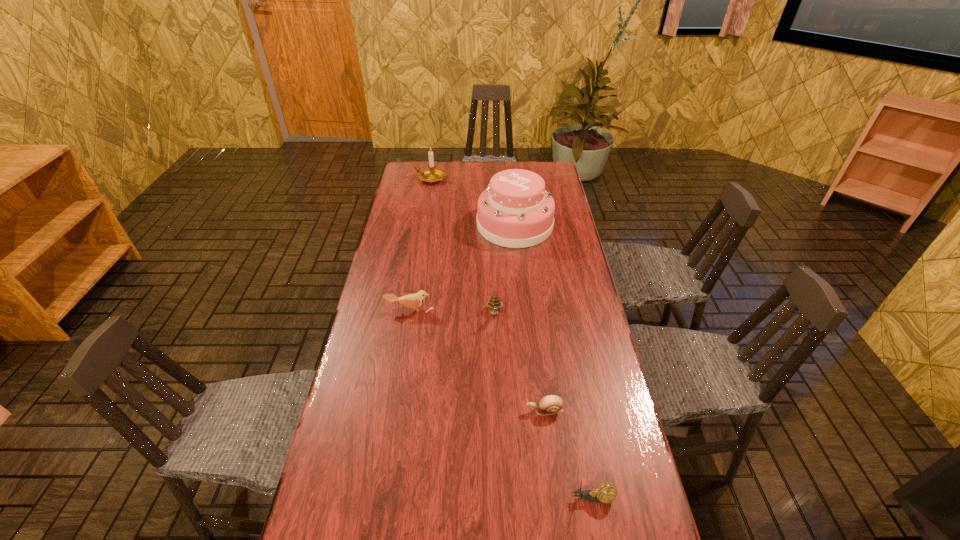
Locate an element on the screen. cake is located at coordinates (515, 211).

This screenshot has height=540, width=960. Find the location of `the fifth nearest object`. the fifth nearest object is located at coordinates (515, 211).

The width and height of the screenshot is (960, 540). Find the location of `the farthest object`. the farthest object is located at coordinates (431, 175).

You are a GUI agent. You are given a task and a screenshot of the screen. Output one action in this format:
    pyautogui.click(x=<x>, y=<y>)
    Task: Click on the candle holder
    Image resolution: width=960 pixels, height=540 pixels.
    Given the screenshot: What is the action you would take?
    pyautogui.click(x=431, y=175)

You are a GUI agent. You are given a task and a screenshot of the screen. Output one action in this format:
    pyautogui.click(x=<x>, y=<y>)
    Task: Click on the farthest escargot
    The image size is (960, 540).
    Given the screenshot: What is the action you would take?
    pyautogui.click(x=494, y=304)

The image size is (960, 540). In order to click on the tallest escargot in this screenshot , I will do `click(494, 304)`.

You are a GUI agent. You are given a task and a screenshot of the screen. Output one action in this format:
    pyautogui.click(x=<x>, y=<y>)
    Task: Click on the bird
    
    Given the screenshot: What is the action you would take?
    pyautogui.click(x=411, y=300)

This screenshot has width=960, height=540. I want to click on the second nearest escargot, so click(551, 404).

Locate an element on the screen. This screenshot has height=540, width=960. the nearest escargot is located at coordinates (606, 492).

You are a GUI agent. You are given a task and a screenshot of the screen. Output one action in this format:
    pyautogui.click(x=<x>, y=<y>)
    Task: Click on the free point located 0.170m on the left of the second farthest object
    Image resolution: width=960 pixels, height=540 pixels.
    Given the screenshot: What is the action you would take?
    pyautogui.click(x=435, y=225)